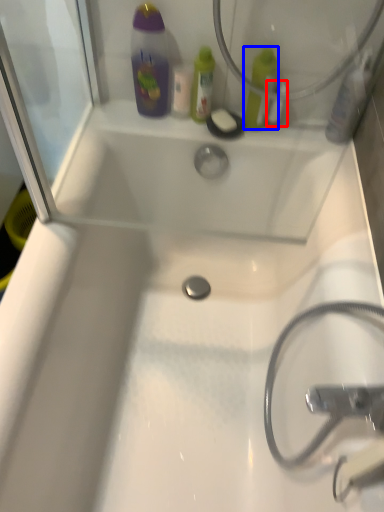
Question: Which object is further to the camera taking this photo, mouthwash (highlighted by a red box) or mouthwash (highlighted by a blue box)?

Choices:
 (A) mouthwash
 (B) mouthwash

Answer: (A)